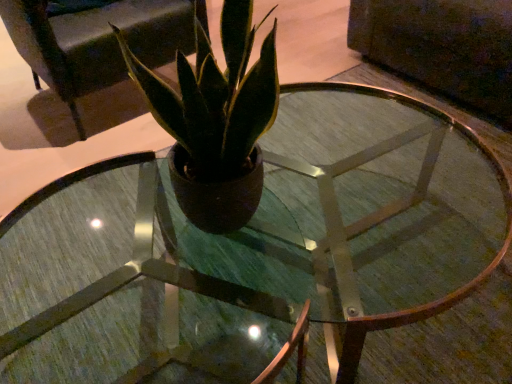
The height and width of the screenshot is (384, 512). Describe the element at coordinates (216, 120) in the screenshot. I see `matte brown pot at center` at that location.

What is the approximate height of matte brown pot at center?

20.99 inches.

This screenshot has height=384, width=512. I want to click on matte brown pot at center, so click(216, 120).

The height and width of the screenshot is (384, 512). I want to click on matte black armchair at upper center, so click(x=98, y=42).

The height and width of the screenshot is (384, 512). Describe the element at coordinates (98, 42) in the screenshot. I see `matte black armchair at upper center` at that location.

In order to click on matte brown pot at center in this screenshot , I will do `click(216, 120)`.

Is matte brown pot at center at the left side of matte black armchair at upper center?

In fact, matte brown pot at center is to the right of matte black armchair at upper center.

Is matte brown pot at center positioned before matte black armchair at upper center?

Yes.

Considering the positions of point (186, 59) and point (104, 46), is point (186, 59) closer or farther from the camera than point (104, 46)?

Point (186, 59) is positioned closer to the camera compared to point (104, 46).

From the image's perspective, relative to matte black armchair at upper center, is matte brown pot at center above or below?

matte brown pot at center is below matte black armchair at upper center.

From a real-world perspective, which object rests below the other?

matte black armchair at upper center is physically lower.

Consider the image. Is matte brown pot at center wider or thinner than matte black armchair at upper center?

Considering their sizes, matte brown pot at center looks slimmer than matte black armchair at upper center.

From their relative heights in the image, would you say matte brown pot at center is taller or shorter than matte black armchair at upper center?

Considering their sizes, matte brown pot at center has less height than matte black armchair at upper center.

Based on their sizes in the image, would you say matte brown pot at center is bigger or smaller than matte black armchair at upper center?

matte brown pot at center is smaller than matte black armchair at upper center.

Is matte brown pot at center situated inside matte black armchair at upper center or outside?

matte brown pot at center lies outside matte black armchair at upper center.

Is matte brown pot at center far from matte black armchair at upper center?

Indeed, matte brown pot at center is not near matte black armchair at upper center.

Is matte brown pot at center oriented towards matte black armchair at upper center?

Yes, matte brown pot at center faces towards matte black armchair at upper center.

At what (x,y) coordinates should I click in order to perform the action: click on houseplant above the matte black armchair at upper center (from a real-world perspective). Please return your answer as a coordinate pair (x, y). The height and width of the screenshot is (384, 512). Looking at the image, I should click on (216, 120).

Is matte black armchair at upper center at the left side of matte brown pot at center?

Correct, you'll find matte black armchair at upper center to the left of matte brown pot at center.

Does matte black armchair at upper center come in front of matte brown pot at center?

No.

Does point (106, 15) appear closer or farther from the camera than point (221, 144)?

Point (106, 15).

From the image's perspective, is matte black armchair at upper center beneath matte brown pot at center?

No, from the image's perspective, matte black armchair at upper center is not beneath matte brown pot at center.

From a real-world perspective, is matte black armchair at upper center above or below matte brown pot at center?

Clearly, from a real-world perspective, matte black armchair at upper center is below matte brown pot at center.

Is matte black armchair at upper center thinner than matte brown pot at center?

No, matte black armchair at upper center is not thinner than matte brown pot at center.

Who is shorter, matte black armchair at upper center or matte brown pot at center?

Standing shorter between the two is matte brown pot at center.

From the picture: Is matte black armchair at upper center bigger than matte brown pot at center?

Correct, matte black armchair at upper center is larger in size than matte brown pot at center.

Does matte black armchair at upper center contain matte brown pot at center?

No, matte brown pot at center is located outside of matte black armchair at upper center.

Is matte black armchair at upper center far away from matte brown pot at center?

Yes, matte black armchair at upper center and matte brown pot at center are quite far apart.

Is matte black armchair at upper center facing away from matte brown pot at center?

No.

In the image, there is a matte brown pot at center. Where is `armchair above it (from the image's perspective)`? The width and height of the screenshot is (512, 384). armchair above it (from the image's perspective) is located at coordinates (98, 42).

Where is `armchair that is behind the matte brown pot at center`? The width and height of the screenshot is (512, 384). armchair that is behind the matte brown pot at center is located at coordinates (98, 42).

Where is `houseplant on the right of matte black armchair at upper center`? houseplant on the right of matte black armchair at upper center is located at coordinates (216, 120).